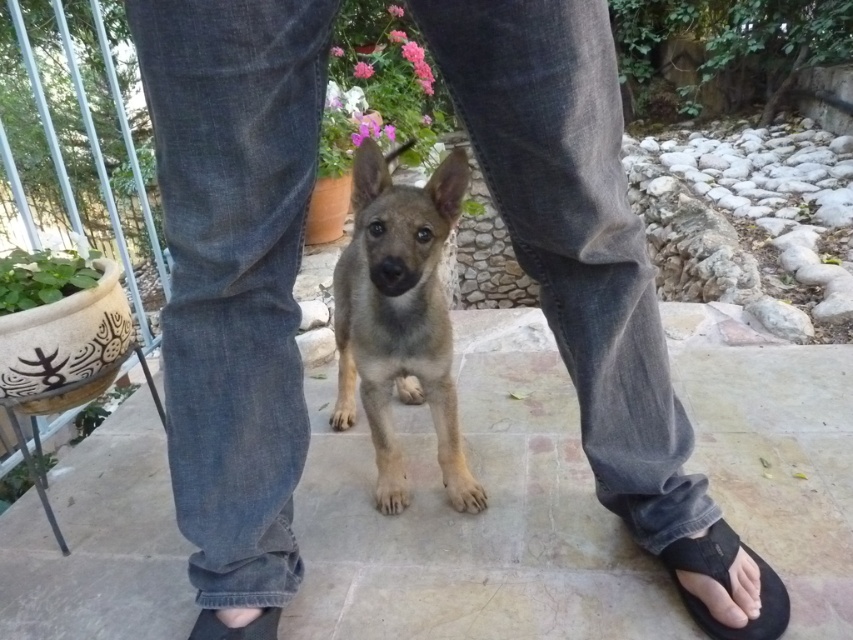
Question: Which point appears closest to the camera in this image?

Choices:
 (A) [264, 609]
 (B) [759, 612]

Answer: (B)

Question: Is fuzzy brown puppy at center bigger than black rubber sandal at lower right?

Choices:
 (A) yes
 (B) no

Answer: (A)

Question: Among these objects, which one is farthest from the camera?

Choices:
 (A) black rubber sandal at lower center
 (B) black rubber sandal at lower right

Answer: (B)

Question: Estimate the real-world distances between objects in this image. Which object is closer to the fuzzy brown puppy at center?

Choices:
 (A) black rubber sandal at lower right
 (B) black rubber sandal at lower center

Answer: (B)

Question: Is fuzzy brown puppy at center bigger than black rubber sandal at lower center?

Choices:
 (A) yes
 (B) no

Answer: (A)

Question: Does fuzzy brown puppy at center appear on the right side of black rubber sandal at lower center?

Choices:
 (A) no
 (B) yes

Answer: (B)